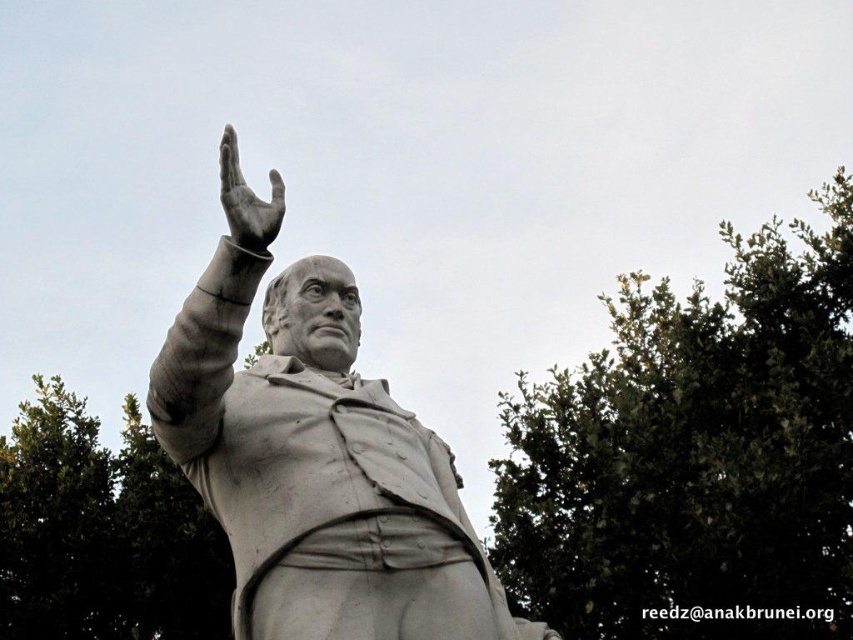
Question: In this image, where is white marble statue at center located relative to polished bronze hand at upper center?

Choices:
 (A) right
 (B) left

Answer: (A)

Question: Which object is closer to the camera taking this photo?

Choices:
 (A) white marble statue at center
 (B) polished bronze hand at upper center

Answer: (A)

Question: Among these points, which one is farthest from the camera?

Choices:
 (A) (402, 506)
 (B) (245, 184)

Answer: (A)

Question: Is white marble statue at center positioned in front of polished bronze hand at upper center?

Choices:
 (A) yes
 (B) no

Answer: (A)

Question: From the image, what is the correct spatial relationship of white marble statue at center in relation to polished bronze hand at upper center?

Choices:
 (A) below
 (B) above

Answer: (A)